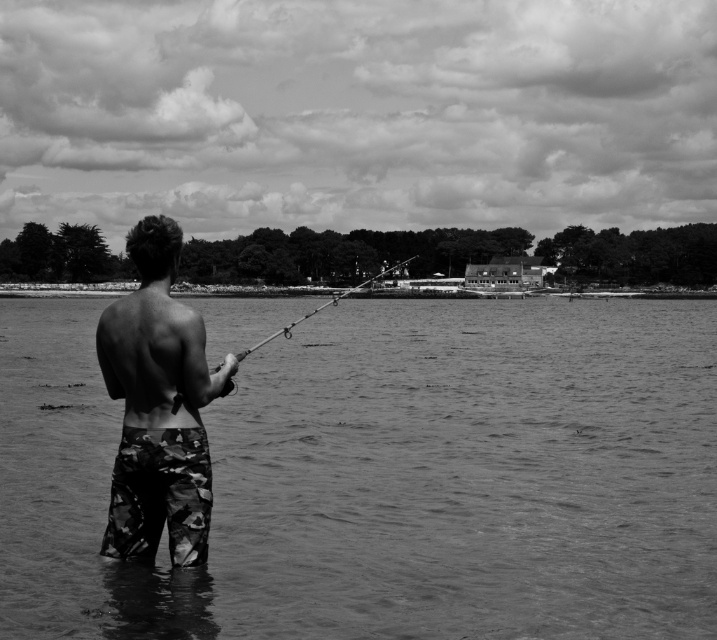
Looking at this image, is smooth water at center closer to the viewer compared to camo-patterned shorts at center?

No, smooth water at center is further to the viewer.

Does point (29, 360) come closer to viewer compared to point (234, 369)?

No, it is not.

The height and width of the screenshot is (640, 717). Find the location of `smooth water at center`. smooth water at center is located at coordinates (386, 477).